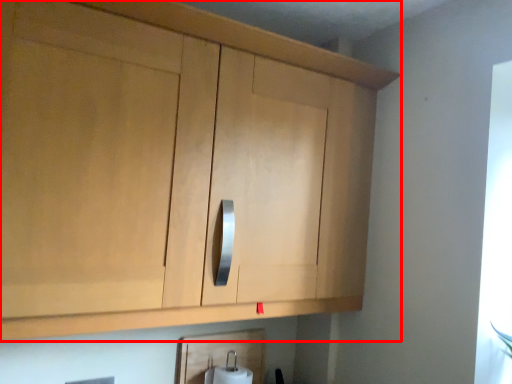
Question: From the image, what is the correct spatial relationship of cabinetry (annotated by the red box) in relation to toilet paper?

Choices:
 (A) right
 (B) left

Answer: (B)